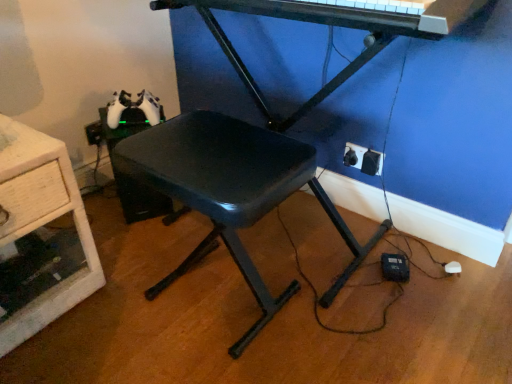
Identify the location of vacant region to the right of black plastic stool at center. (348, 334).